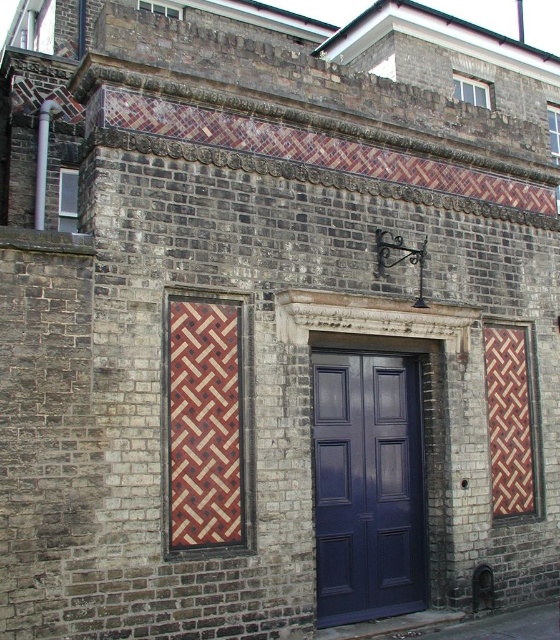
Question: Does dull blue wood door at center lie in front of woven wood tapestry at center?

Choices:
 (A) no
 (B) yes

Answer: (A)

Question: Among these points, which one is farthest from the camera?

Choices:
 (A) (224, 330)
 (B) (516, 413)
 (C) (389, 438)

Answer: (B)

Question: Is dull blue wood door at center smaller than woven wood panel at right?

Choices:
 (A) no
 (B) yes

Answer: (A)

Question: Can you confirm if dull blue wood door at center is positioned to the left of woven wood panel at right?

Choices:
 (A) no
 (B) yes

Answer: (B)

Question: Which object is closer to the camera taking this photo?

Choices:
 (A) dull blue wood door at center
 (B) woven wood panel at right

Answer: (A)

Question: Among these objects, which one is farthest from the camera?

Choices:
 (A) woven wood panel at right
 (B) woven wood tapestry at center

Answer: (A)